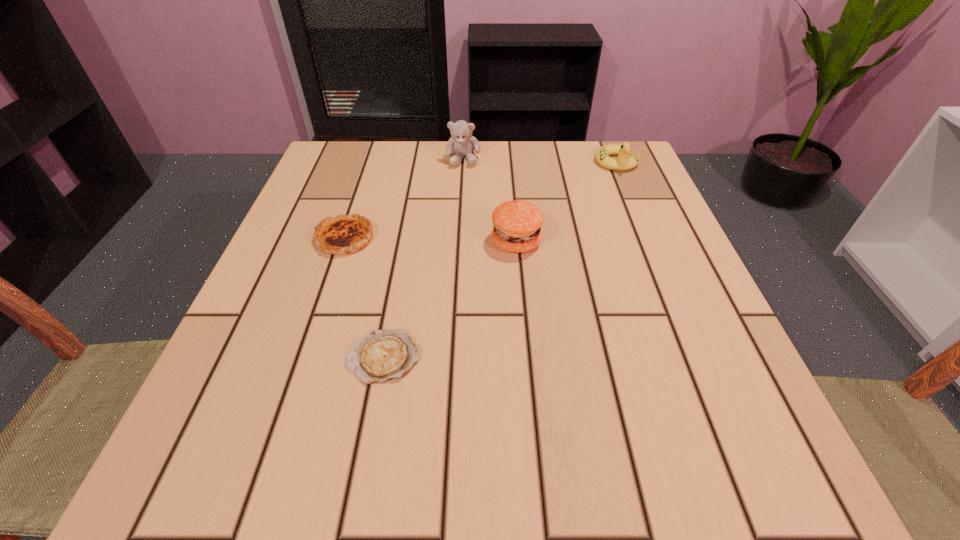
In order to click on free space between the tallest object and the right quiche in this screenshot , I will do click(x=423, y=258).

This screenshot has height=540, width=960. Identify the location of vacant area between the right quiche and the teddy bear. (423, 258).

Find the location of a particular element. free space between the patty and the leftmost object is located at coordinates (430, 240).

Find the location of `free area in between the second object from right to left and the rightmost object`. free area in between the second object from right to left and the rightmost object is located at coordinates (566, 202).

Identify the location of the second closest object to the duckling. (462, 143).

Point out which object is positioned as the third nearest to the patty. Please provide its 2D coordinates. Your answer should be formatted as a tuple, i.e. [(x, y)], where the tuple contains the x and y coordinates of a point satisfying the conditions above.

[(345, 234)]

The width and height of the screenshot is (960, 540). Find the location of `free space that satisfies the following two spatial constraints: 1. on the front side of the farther quiche; 2. on the left side of the second object from right to left`. free space that satisfies the following two spatial constraints: 1. on the front side of the farther quiche; 2. on the left side of the second object from right to left is located at coordinates (344, 241).

Identify the location of free location that satisfies the following two spatial constraints: 1. on the back side of the patty; 2. on the left side of the shortest object. The width and height of the screenshot is (960, 540). (405, 241).